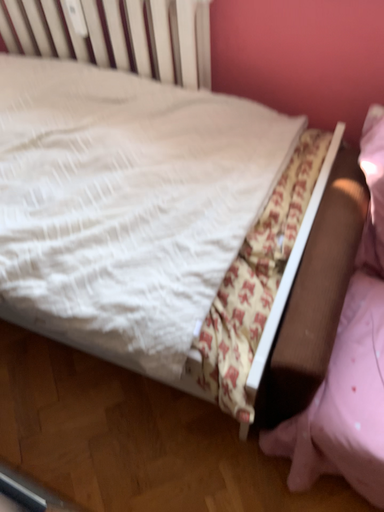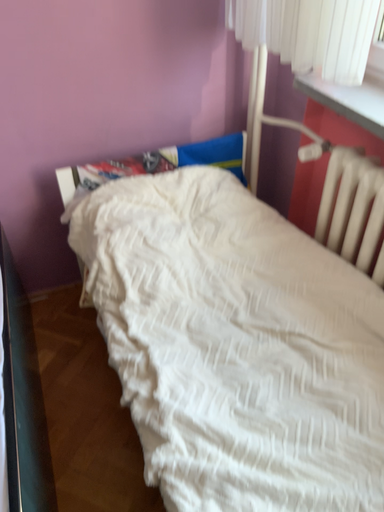
Question: How did the camera likely rotate when shooting the video?

Choices:
 (A) rotated downward
 (B) rotated upward

Answer: (B)